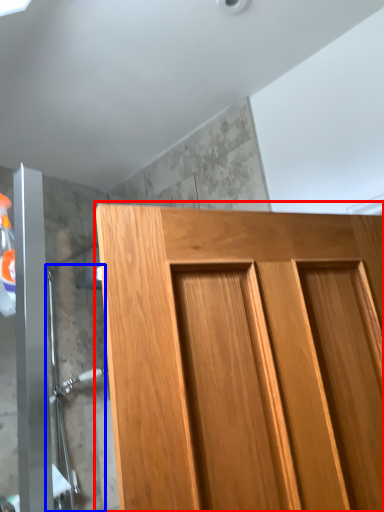
Question: Which object is closer to the camera taking this photo, door (highlighted by a red box) or shower door (highlighted by a blue box)?

Choices:
 (A) door
 (B) shower door

Answer: (A)